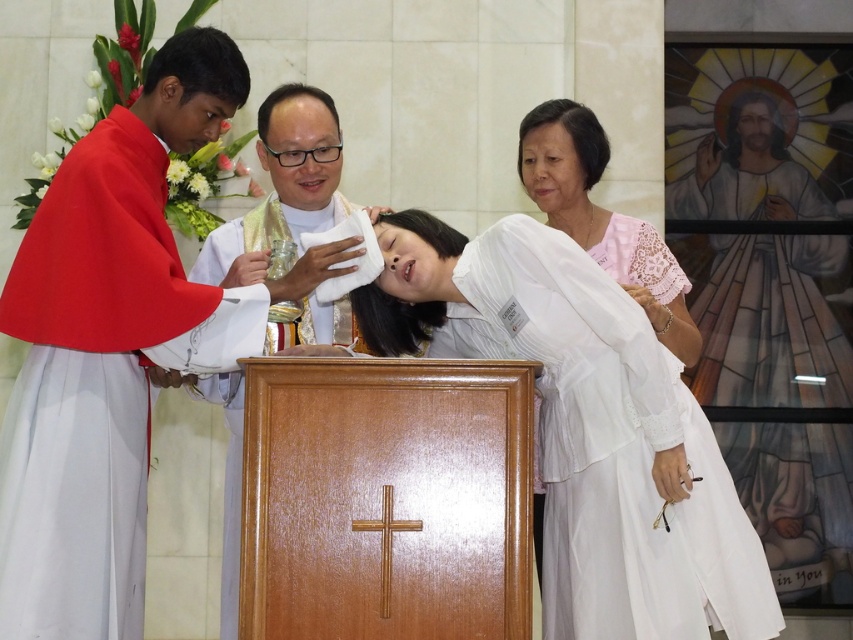
You are an attendee at this ceremony and want to know the spatial arrangement of the two participants. Based on the scene, is the matte red robe at left positioned higher or lower than the white lace dress at right?

The matte red robe at left is located below the white lace dress at right, so it is positioned lower compared to the white lace dress at right.

You are an attendee at this religious ceremony and need to locate the officiant performing the main ritual. Which robe is worn by the officiant, the white lace robe at center or the matte red robe at left?

The white lace robe at center is worn by the officiant performing the main ritual as it is positioned at the center, which is typically the focal point during ceremonies.